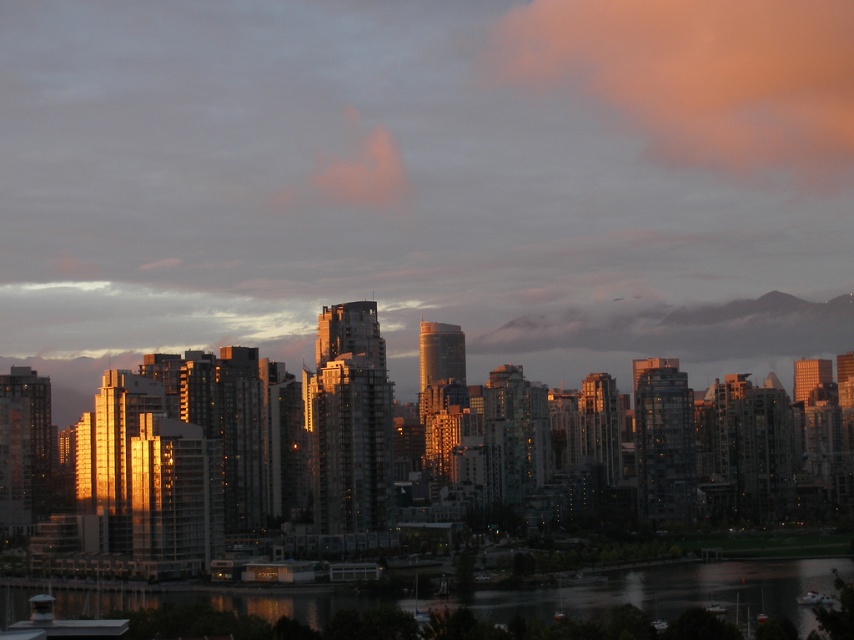
You are an architect designing a new skyscraper and want to ensure that the pink fluffy cloud at upper center does not block the view of the reflective glass water at lower center from the top floor. Given their sizes, is this feasible?

The pink fluffy cloud at upper center is narrower than the reflective glass water at lower center, so it is feasible to design the skyscraper such that the cloud does not block the view of the water from the top floor.

You are an architect designing a new skyscraper that needs to have a clear view of the pink fluffy cloud at upper center and the reflective glass water at lower center. Based on the scene, which object is positioned higher in the sky, requiring the building to be designed with taller windows to ensure visibility?

The pink fluffy cloud at upper center is taller than the reflective glass water at lower center, so the building should have taller windows to ensure visibility of the pink fluffy cloud at upper center.

You are an architect designing a new building in this city. You want to ensure that the building does not block the view of the pink fluffy cloud at upper center from the reflective glass water at lower center. Based on the scene description, what should you consider about the building height?

The pink fluffy cloud at upper center is positioned over reflective glass water at lower center, so the building should be constructed at a height lower than the line of sight between them to avoid blocking the view.